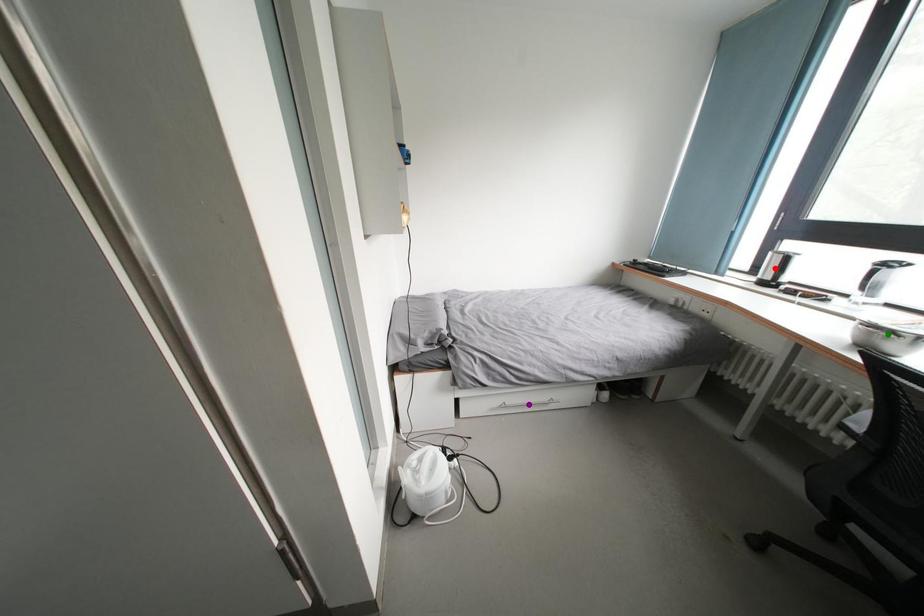
Order these from nearest to farthest:
1. green point
2. purple point
3. red point

green point, purple point, red point